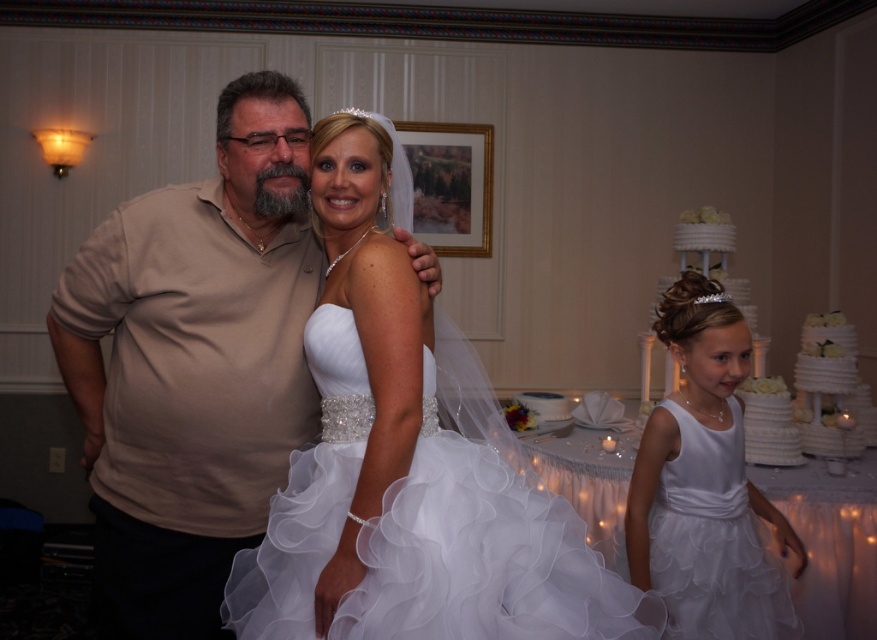
You are standing in the wedding scene and want to take a photo of the couple and the cake. The photographer tells you that the optimal distance for the shot is exactly 7 feet. Can you position yourself at the point marked as point (738, 369) to capture the perfect shot?

The point (738, 369) is 7.14 feet from the viewer. Since the optimal distance is exactly 7 feet, positioning yourself at point (738, 369) would be slightly too far to achieve the perfect shot.

You are a photographer at the wedding. You need to adjust the lighting so that both the white satin dress at center and the white textured cake at right are well lit. Since they are different distances from the camera, which one should you focus on first to ensure proper exposure?

The white satin dress at center is below the white textured cake at right, so you should focus on the white satin dress at center first because it is closer to the camera and requires proper exposure before adjusting for the cake further away.